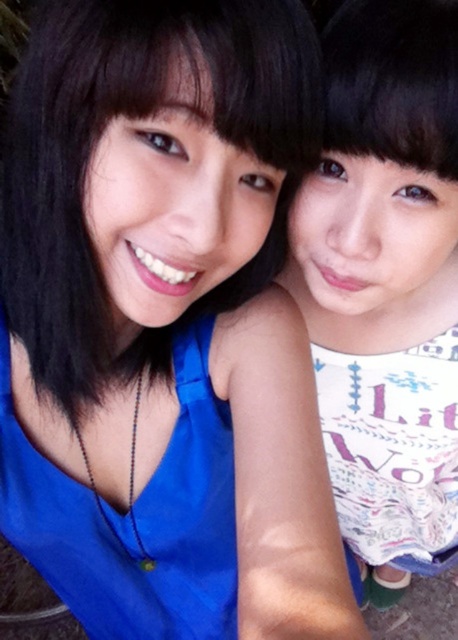
Who is more distant from viewer, (454, 262) or (54, 573)?

The point (454, 262) is behind.

Is point (365, 291) farther from camera compared to point (229, 550)?

No, it is not.

Where is `white printed dress at center`? This screenshot has width=458, height=640. white printed dress at center is located at coordinates (385, 275).